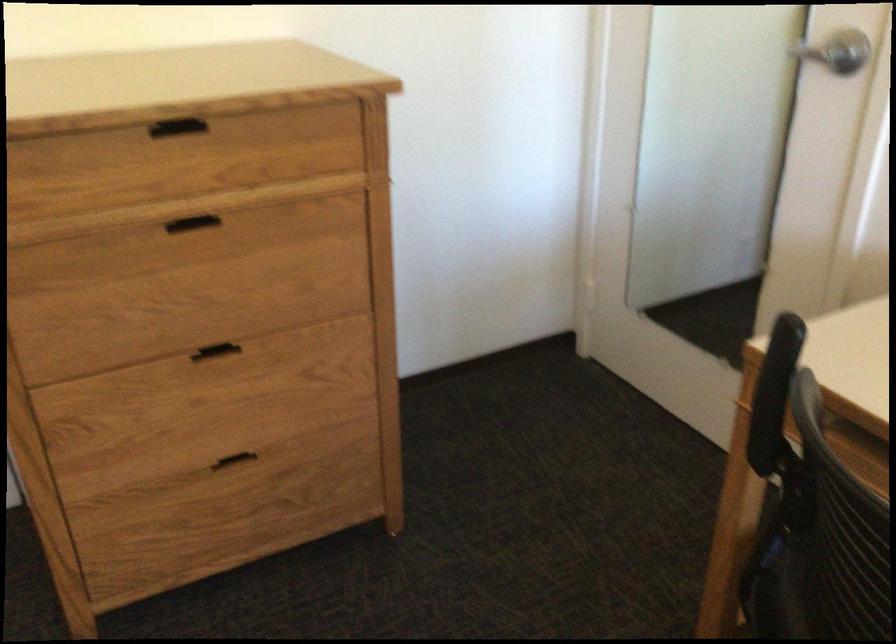
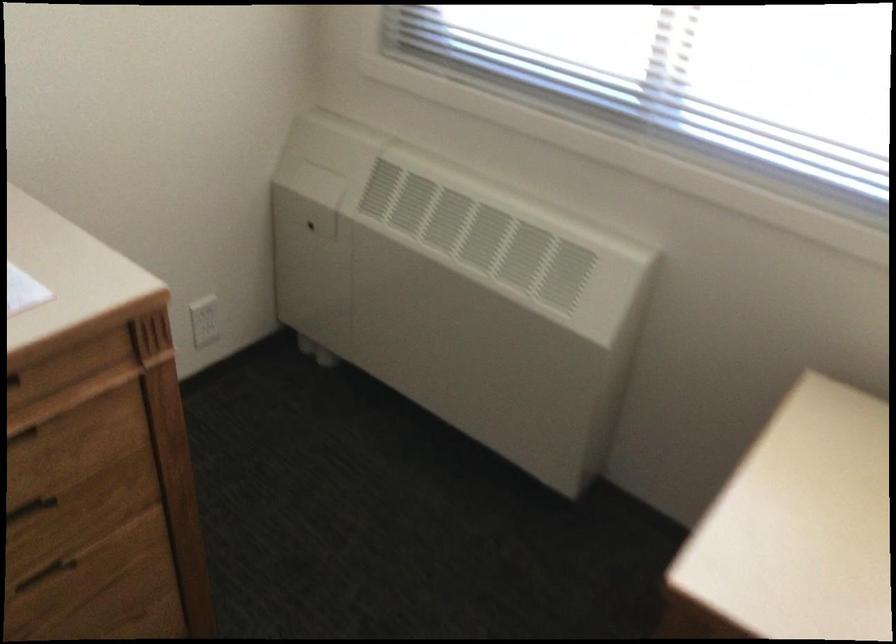
In the scene shown: First-person continuous shooting, in which direction is the camera rotating?

The camera rotated toward right-down.